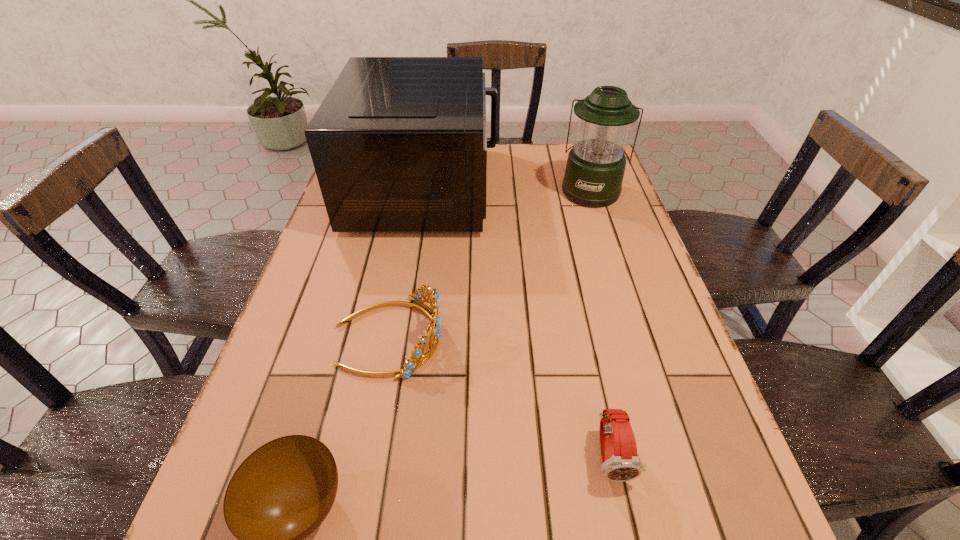
Where is `microwave_oven`? This screenshot has width=960, height=540. microwave_oven is located at coordinates (399, 144).

This screenshot has height=540, width=960. Identify the location of lantern. (595, 167).

The image size is (960, 540). I want to click on the third tallest object, so click(x=417, y=353).

Find the location of `the third nearest object`. the third nearest object is located at coordinates (417, 353).

Where is `the fourth tallest object`? the fourth tallest object is located at coordinates (620, 462).

The height and width of the screenshot is (540, 960). In order to click on free location located on the front-facing side of the microwave_oven in this screenshot , I will do `click(544, 188)`.

Find the location of a particular element. This screenshot has height=540, width=960. free space located on the front of the lantern is located at coordinates (612, 254).

Locate an element on the screen. vacant position located 0.390m on the front-facing side of the tiara is located at coordinates (625, 336).

At what (x,y) coordinates should I click in order to perform the action: click on microwave_oven located at the far edge. Please return your answer as a coordinate pair (x, y). The image size is (960, 540). Looking at the image, I should click on (399, 144).

Image resolution: width=960 pixels, height=540 pixels. Find the location of `lantern located at the far edge`. lantern located at the far edge is located at coordinates (595, 167).